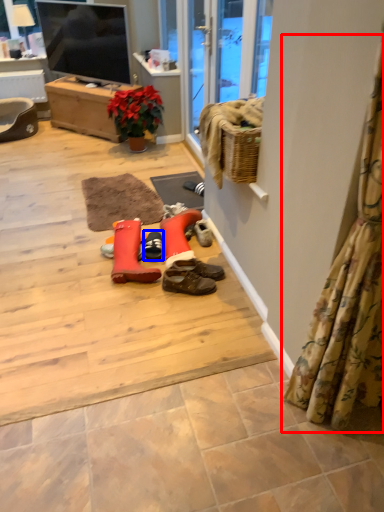
Question: Which point is closer to the camera, curtain (highlighted by a red box) or footwear (highlighted by a blue box)?

Choices:
 (A) curtain
 (B) footwear

Answer: (A)